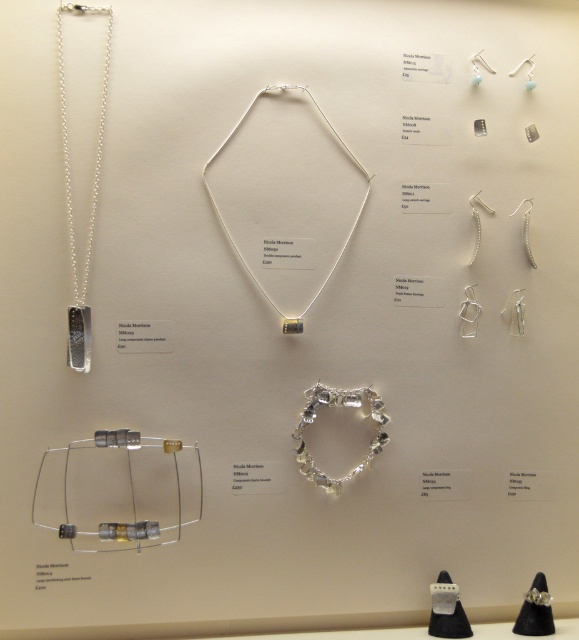
Which of these two, silver/metallic necklace at center or clear glass bracelet at center, stands shorter?

clear glass bracelet at center

Who is higher up, silver/metallic necklace at center or clear glass bracelet at center?

silver/metallic necklace at center

Measure the distance between silver/metallic necklace at center and camera.

A distance of 4.46 feet exists between silver/metallic necklace at center and camera.

The height and width of the screenshot is (640, 579). I want to click on silver/metallic necklace at center, so click(287, 196).

The width and height of the screenshot is (579, 640). Describe the element at coordinates (119, 490) in the screenshot. I see `silver/glass wire bracelet at lower left` at that location.

Is silver/glass wire bracelet at lower left to the left of silver metallic chain pendant at left from the viewer's perspective?

Incorrect, silver/glass wire bracelet at lower left is not on the left side of silver metallic chain pendant at left.

Between point (164, 492) and point (90, 224), which one is positioned behind?

The point (164, 492) is behind.

Where is `silver/glass wire bracelet at lower left`? silver/glass wire bracelet at lower left is located at coordinates (119, 490).

In the scene shown: Does silver/metallic necklace at center come in front of silver/glass wire bracelet at lower left?

That is False.

Which is more to the left, silver/metallic necklace at center or silver/glass wire bracelet at lower left?

Positioned to the left is silver/glass wire bracelet at lower left.

The width and height of the screenshot is (579, 640). I want to click on silver/metallic necklace at center, so click(287, 196).